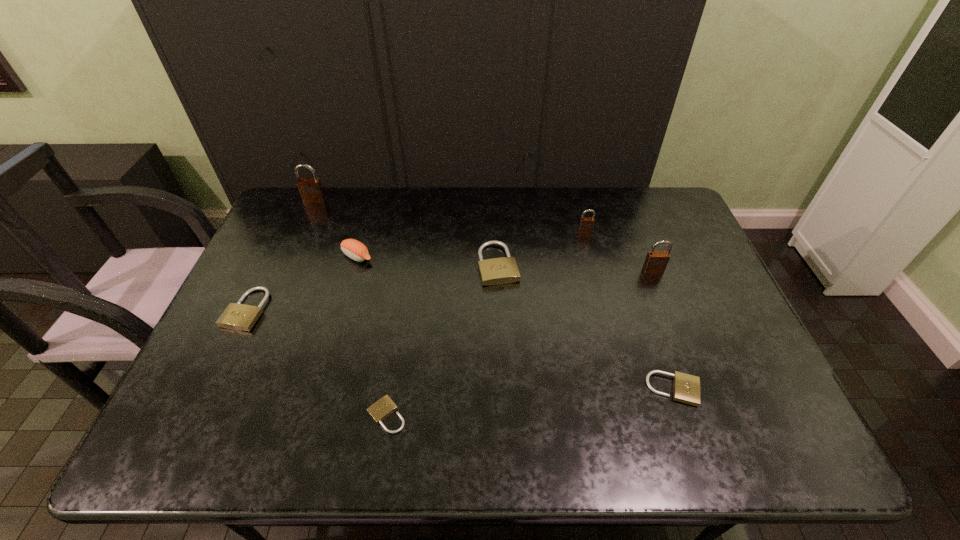
Locate an element on the screen. Image resolution: width=960 pixels, height=540 pixels. empty space that is in between the seventh shortest object and the sixth tallest padlock is located at coordinates (663, 330).

Locate an element on the screen. free space between the second shortest object and the second farthest beige padlock is located at coordinates (460, 349).

Locate an element on the screen. The height and width of the screenshot is (540, 960). free spot between the biggest brown padlock and the third biggest beige padlock is located at coordinates (494, 295).

Locate an element on the screen. The width and height of the screenshot is (960, 540). free space between the third biggest beige padlock and the shortest object is located at coordinates (530, 402).

Where is `object that can be found as the sixth closest to the salmon sushi`? Image resolution: width=960 pixels, height=540 pixels. object that can be found as the sixth closest to the salmon sushi is located at coordinates (656, 262).

Select which object appears as the second closest to the seventh tallest object. Please provide its 2D coordinates. Your answer should be formatted as a tuple, i.e. [(x, y)], where the tuple contains the x and y coordinates of a point satisfying the conditions above.

[(504, 270)]

Locate an element on the screen. Image resolution: width=960 pixels, height=540 pixels. padlock object that ranks as the closest to the fourth shortest object is located at coordinates (586, 224).

Where is `padlock that is the fifth closest to the third padlock from right to left`? The height and width of the screenshot is (540, 960). padlock that is the fifth closest to the third padlock from right to left is located at coordinates (311, 190).

Where is `brown padlock that can be found as the second closest to the salmon sushi`? brown padlock that can be found as the second closest to the salmon sushi is located at coordinates (586, 224).

Identify which brown padlock is located as the nearest to the seventh tallest object. Please provide its 2D coordinates. Your answer should be formatted as a tuple, i.e. [(x, y)], where the tuple contains the x and y coordinates of a point satisfying the conditions above.

[(656, 262)]